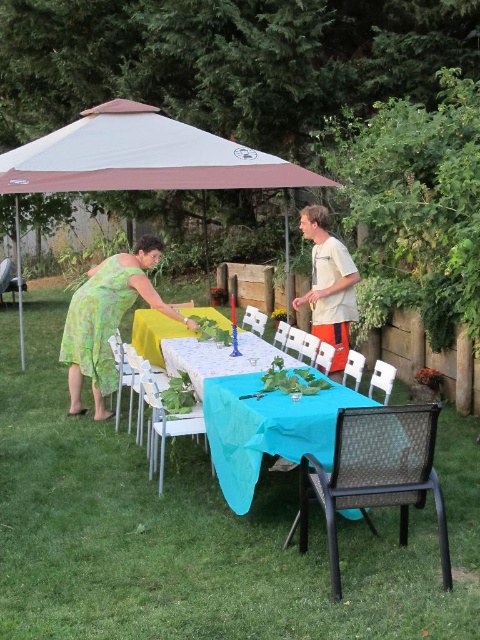
From the picture: Who is more distant from viewer, (113,278) or (336,353)?

The point (113,278) is behind.

Which of these two, green floral dress at center or light gray t-shirt at center, stands shorter?

Standing shorter between the two is light gray t-shirt at center.

Where is `green floral dress at center`? green floral dress at center is located at coordinates (107, 321).

Is white fabric umbrella at upper center above turquoise fabric table at center?

Yes.

Does point (156, 168) come farther from viewer compared to point (227, 477)?

Yes, point (156, 168) is behind point (227, 477).

Find the location of a particular element. Image resolution: width=480 pixels, height=640 pixels. white fabric umbrella at upper center is located at coordinates (137, 161).

Can you confirm if light gray t-shirt at center is bigger than yellow fabric table at center?

Incorrect, light gray t-shirt at center is not larger than yellow fabric table at center.

Find the location of a particular element. The height and width of the screenshot is (640, 480). light gray t-shirt at center is located at coordinates point(328,285).

Which is behind, point (338, 241) or point (188, 310)?

The point (188, 310) is more distant.

I want to click on light gray t-shirt at center, so (328, 285).